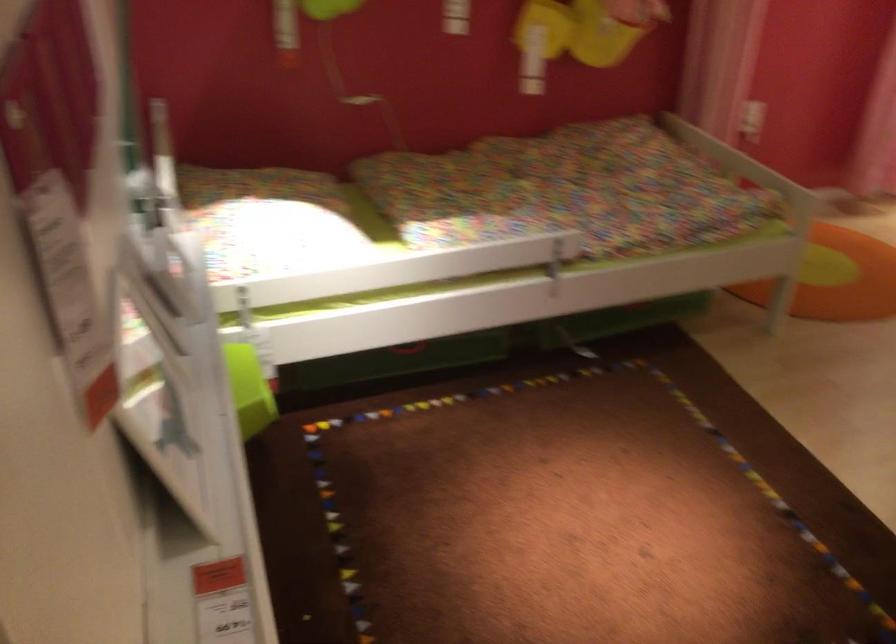
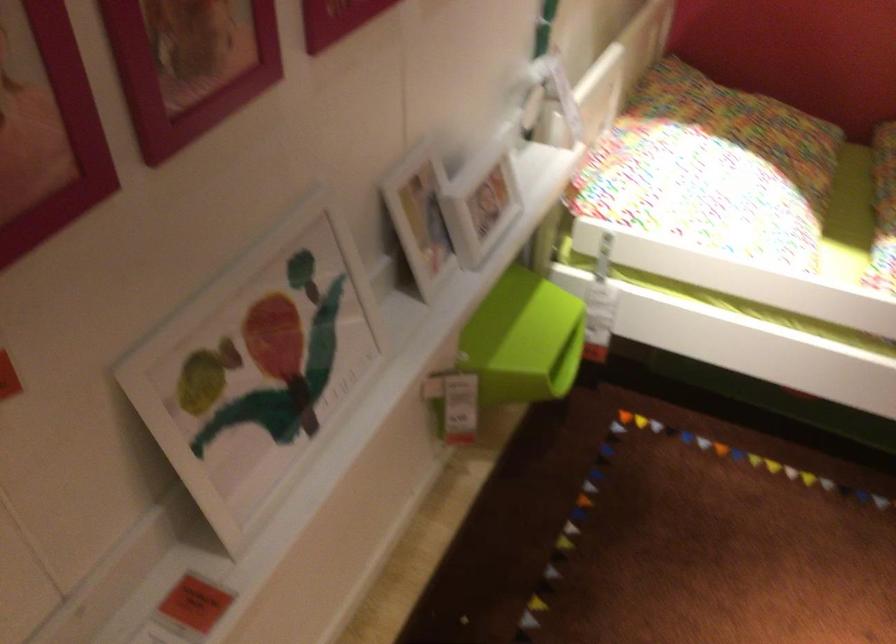
Find the pixel in the second image that matches pixel 177 275 in the first image.

(479, 200)